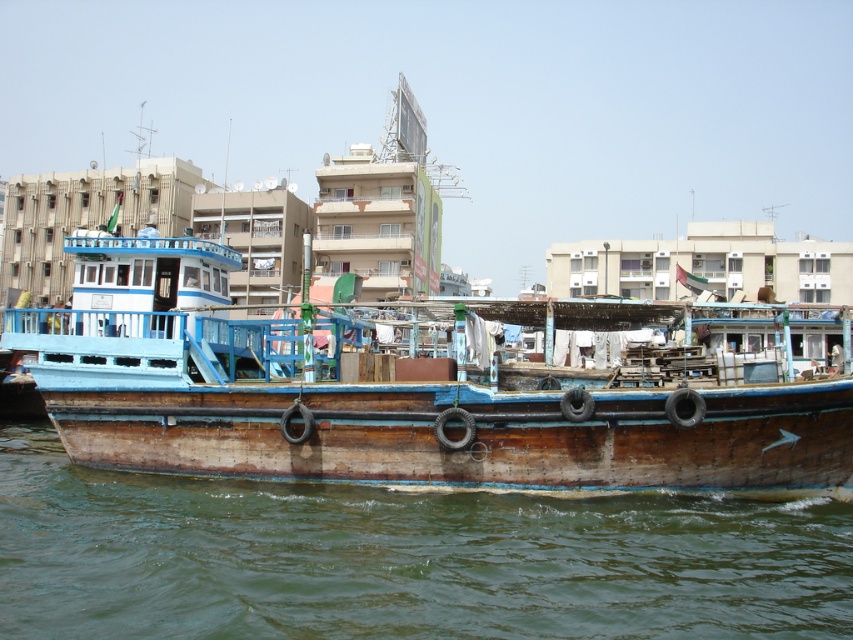
From the picture: Does wooden boat at center lie in front of brown wooden water at lower center?

No, wooden boat at center is behind brown wooden water at lower center.

Which is behind, point (171, 344) or point (556, 580)?

Point (171, 344)

Locate an element on the screen. The width and height of the screenshot is (853, 640). wooden boat at center is located at coordinates (397, 390).